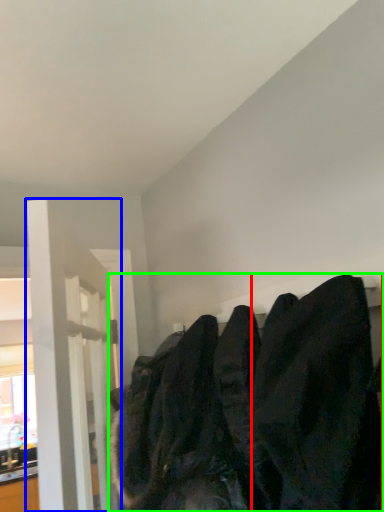
Question: Which is nearer to the clothing (highlighted by a red box)? door (highlighted by a blue box) or sweatshirt (highlighted by a green box).

Choices:
 (A) door
 (B) sweatshirt

Answer: (B)